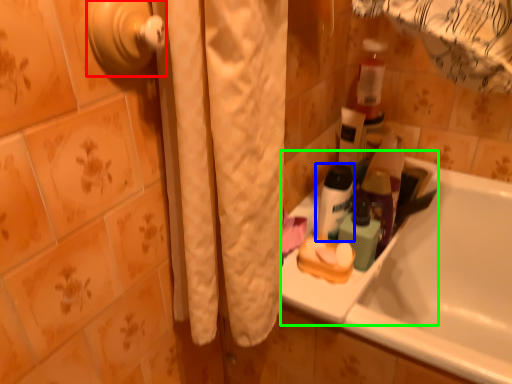
Question: Which object is the farthest from door handle (highlighted by a red box)? Choose among these: toiletry (highlighted by a blue box) or sink (highlighted by a green box).

Choices:
 (A) toiletry
 (B) sink

Answer: (B)